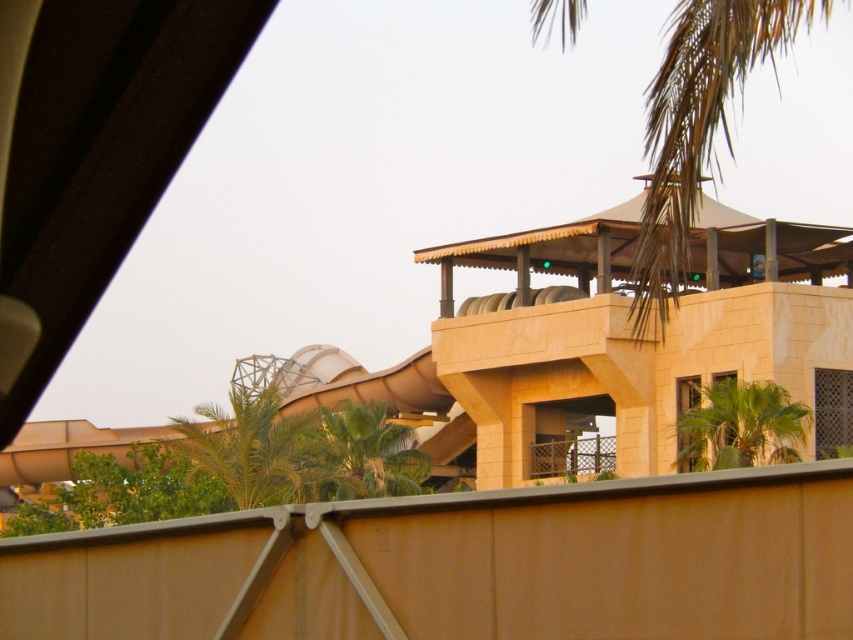
Can you confirm if green leafy palm tree at upper right is smaller than green leafy palm tree at lower right?

No.

Is green leafy palm tree at upper right taller than green leafy palm tree at lower right?

Yes, green leafy palm tree at upper right is taller than green leafy palm tree at lower right.

Identify the location of green leafy palm tree at upper right. The height and width of the screenshot is (640, 853). (698, 122).

Can you confirm if green leafy palm tree at upper right is positioned below green leafy palm tree at center?

No, green leafy palm tree at upper right is not below green leafy palm tree at center.

Is green leafy palm tree at upper right to the right of green leafy palm tree at center from the viewer's perspective?

Yes, green leafy palm tree at upper right is to the right of green leafy palm tree at center.

Is point (723, 93) less distant than point (363, 449)?

Yes, point (723, 93) is in front of point (363, 449).

I want to click on green leafy palm tree at upper right, so click(698, 122).

Describe the element at coordinates (740, 426) in the screenshot. I see `green leafy palm tree at lower right` at that location.

Can you confirm if green leafy palm tree at lower right is positioned to the left of green leafy palm tree at center?

In fact, green leafy palm tree at lower right is to the right of green leafy palm tree at center.

Is point (711, 406) positioned behind point (347, 458)?

No, (711, 406) is closer to viewer.

The image size is (853, 640). In order to click on green leafy palm tree at lower right in this screenshot , I will do `click(740, 426)`.